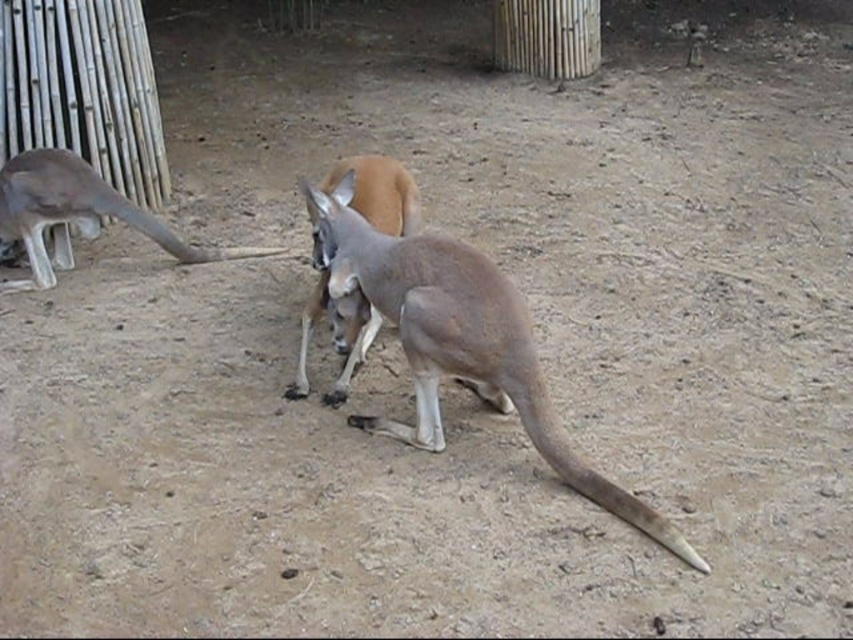
Question: Which point is farther from the camera taking this photo?

Choices:
 (A) (496, 381)
 (B) (3, 193)

Answer: (B)

Question: Does gray fur kangaroo at center appear under gray fur kangaroo at left?

Choices:
 (A) no
 (B) yes

Answer: (B)

Question: Can you confirm if gray fur kangaroo at center is wider than gray fur kangaroo at left?

Choices:
 (A) no
 (B) yes

Answer: (B)

Question: Does gray fur kangaroo at center have a greater width compared to gray fur kangaroo at left?

Choices:
 (A) no
 (B) yes

Answer: (B)

Question: Among these objects, which one is nearest to the camera?

Choices:
 (A) gray fur kangaroo at center
 (B) gray fur kangaroo at left

Answer: (A)

Question: Which point is closer to the camera?

Choices:
 (A) (4, 173)
 (B) (397, 314)

Answer: (B)